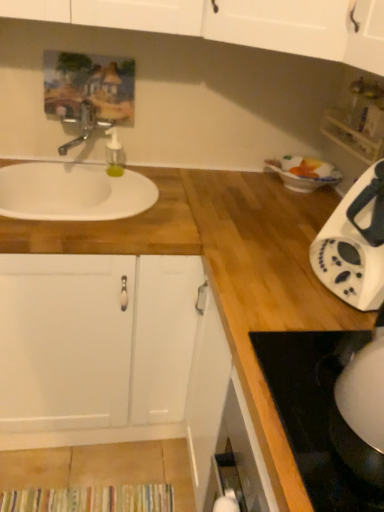
Find the location of `free space to the back side of white glossy electric kettle at lower right`. free space to the back side of white glossy electric kettle at lower right is located at coordinates (312, 348).